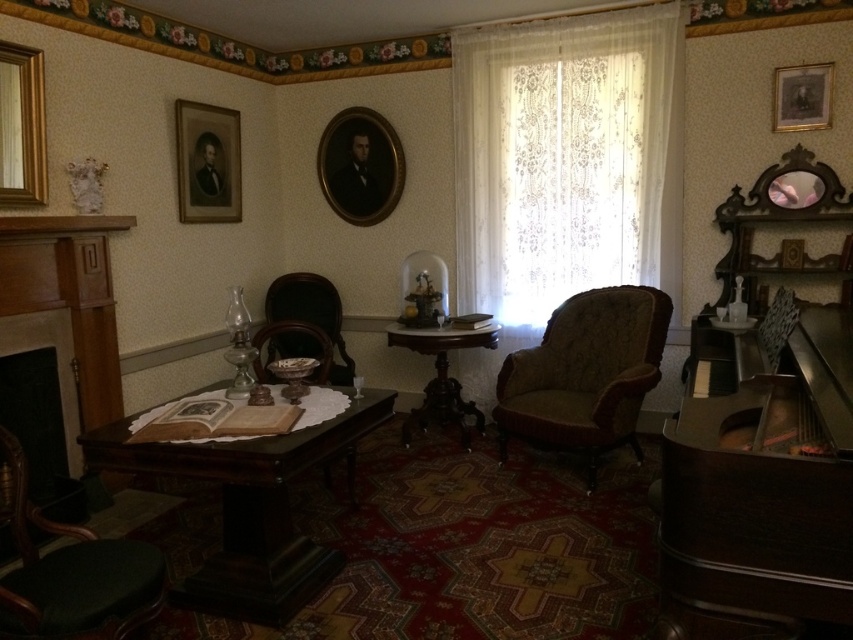
Question: Is velvet brown armchair at center to the right of gold-framed portrait at upper left from the viewer's perspective?

Choices:
 (A) no
 (B) yes

Answer: (B)

Question: Among these points, which one is nearest to the camera?

Choices:
 (A) (6, 93)
 (B) (387, 192)
 (C) (514, 358)

Answer: (A)

Question: Can you confirm if polished dark wood table at center is positioned to the left of velvet brown armchair at center?

Choices:
 (A) yes
 (B) no

Answer: (A)

Question: Which point appears farthest from the camera in this image?

Choices:
 (A) (810, 115)
 (B) (488, 208)

Answer: (B)

Question: Which object is farther from the camera taking this photo?

Choices:
 (A) gold-framed portrait at upper right
 (B) matte dark wood armchair at center
 (C) polished dark wood table at center
 (D) wooden polished table at center

Answer: (B)

Question: Considering the relative positions of green fabric armchair at lower left and wooden polished table at center in the image provided, where is green fabric armchair at lower left located with respect to wooden polished table at center?

Choices:
 (A) below
 (B) above

Answer: (A)